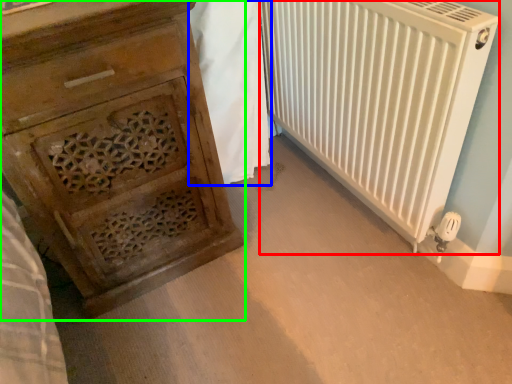
Question: Estimate the real-world distances between objects in this image. Which object is farther from radiator (highlighted by a red box), blanket (highlighted by a blue box) or chest of drawers (highlighted by a green box)?

Choices:
 (A) blanket
 (B) chest of drawers

Answer: (B)